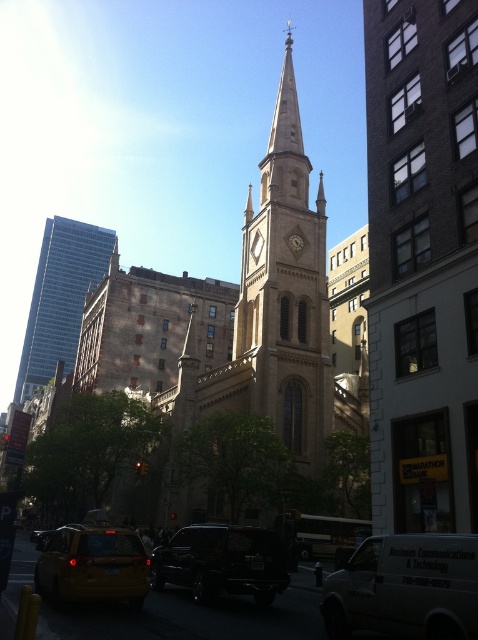
What do you see at coordinates (60, 298) in the screenshot? The height and width of the screenshot is (640, 478). I see `blue glass skyscraper at left` at bounding box center [60, 298].

Can you confirm if blue glass skyscraper at left is taller than shiny black suv at center?

Indeed, blue glass skyscraper at left has a greater height compared to shiny black suv at center.

This screenshot has height=640, width=478. Describe the element at coordinates (60, 298) in the screenshot. I see `blue glass skyscraper at left` at that location.

Locate an element on the screen. This screenshot has width=478, height=640. blue glass skyscraper at left is located at coordinates (60, 298).

Is shiny black suv at center positioned in front of yellow matte taxi at lower left?

That is False.

Between shiny black suv at center and yellow matte taxi at lower left, which one has less height?

Standing shorter between the two is yellow matte taxi at lower left.

Between point (256, 564) and point (104, 563), which one is positioned in front?

Point (104, 563)

The width and height of the screenshot is (478, 640). What are the coordinates of `shiny black suv at center` in the screenshot? It's located at (221, 563).

Looking at this image, does white matte van at center have a greater height compared to yellow matte taxi at lower left?

Yes.

Is white matte van at center further to camera compared to yellow matte taxi at lower left?

No, white matte van at center is in front of yellow matte taxi at lower left.

Which is in front, point (347, 634) or point (88, 592)?

Point (347, 634) is more forward.

Where is `white matte van at center`? white matte van at center is located at coordinates (405, 588).